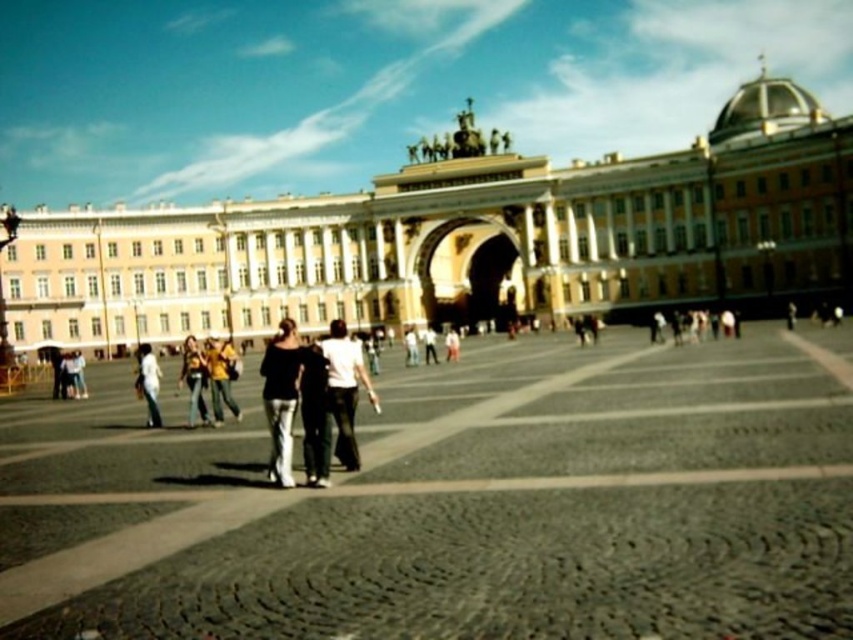
You are standing in the plaza and want to take a photo of the yellow stone building at center and the white cotton shirt at center. Which object should you focus on first to ensure both are in the frame?

You should focus on the yellow stone building at center first since it is closer to you than the white cotton shirt at center, ensuring both are in the frame.

You are a photographer planning to capture a group photo of the two people wearing the matte black top at center and the white cotton shirt at center. Based on the scene description, which person should you position closer to the camera to ensure both appear equally sized in the photo?

The matte black top at center is wider than the white cotton shirt at center. To make both appear equally sized in the photo, position the person wearing the white cotton shirt at center closer to the camera since their clothing is narrower.

You are a tourist standing in the plaza and want to take a photo of the yellow stone building at center without including the white cotton shirt at center in the frame. Is it possible to do so by moving sideways? Please explain your reasoning.

The yellow stone building at center is wider than the white cotton shirt at center. Since the building is wider, moving sideways could allow you to position yourself so that the shirt is out of the frame while keeping the building centered. However, this depends on the exact dimensions and distance between them. If the building is significantly wider, there might be enough space to maneuver without including the shirt.